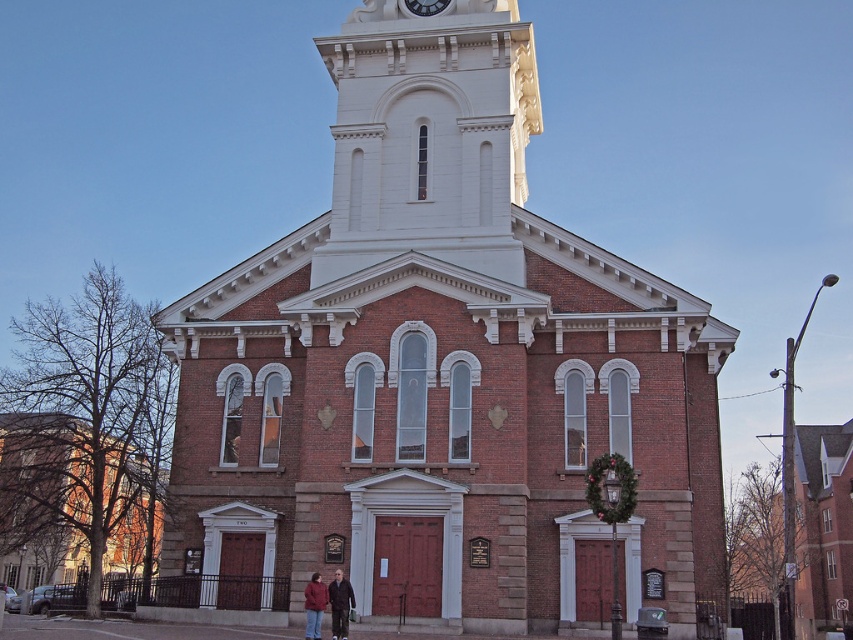
You are standing in front of the church and see two jackets on the ground. The matte brown jacket at center and the matte red jacket at lower center. Which jacket is wider?

The matte brown jacket at center is wider than the matte red jacket at lower center.

You are standing in the middle of a town square and see the brick church at center. If you want to take a photo of the church with the town hall behind it, which is located at point 0.5, 0.5, should you move left or right?

Since the brick church at center is located at point (444, 365), which is slightly to the right and above the town hall at (426, 320), you should move to the left to align the church with the town hall in the background for the photo.